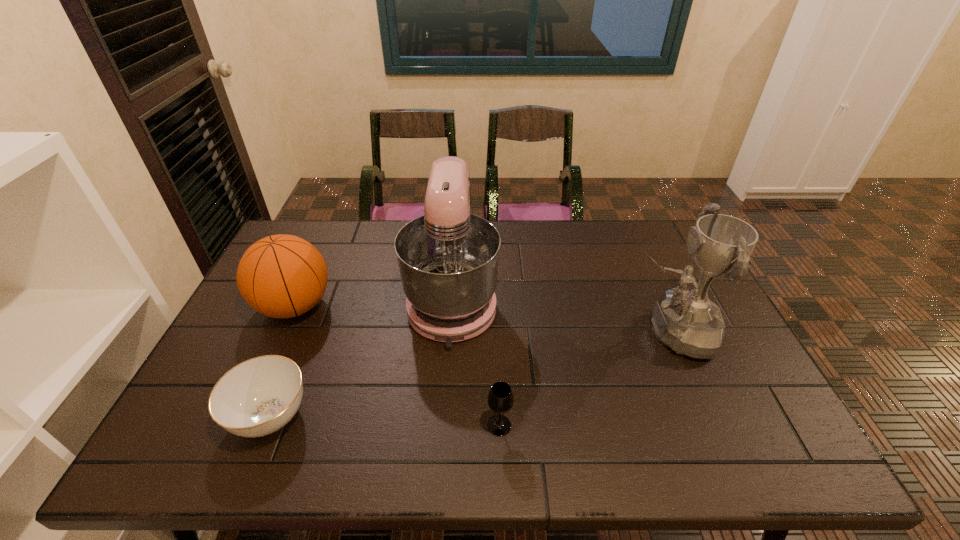
Locate an element on the screen. vacant space situated 0.120m on the back of the fourth tallest object is located at coordinates (497, 373).

I want to click on vacant area situated on the right of the shortest object, so click(410, 416).

Identify the location of object positioned at the far edge. The height and width of the screenshot is (540, 960). (448, 258).

Find the location of `wineglass located in the near edge section of the desktop`. wineglass located in the near edge section of the desktop is located at coordinates (500, 399).

Find the location of a particular element. Image resolution: width=960 pixels, height=540 pixels. chinaware that is positioned at the near edge is located at coordinates (259, 396).

You are a GUI agent. You are given a task and a screenshot of the screen. Output one action in this format:
    pyautogui.click(x=<x>, y=<y>)
    Task: Click on the basketball present at the left edge
    The width and height of the screenshot is (960, 540).
    Given the screenshot: What is the action you would take?
    pyautogui.click(x=281, y=276)

Where is `chinaware that is at the left edge`? chinaware that is at the left edge is located at coordinates (259, 396).

Where is `object present at the right edge`? This screenshot has height=540, width=960. object present at the right edge is located at coordinates (687, 321).

Locate an element on the screen. object present at the near left corner is located at coordinates (259, 396).

This screenshot has height=540, width=960. I want to click on vacant space at the far edge of the desktop, so click(x=595, y=222).